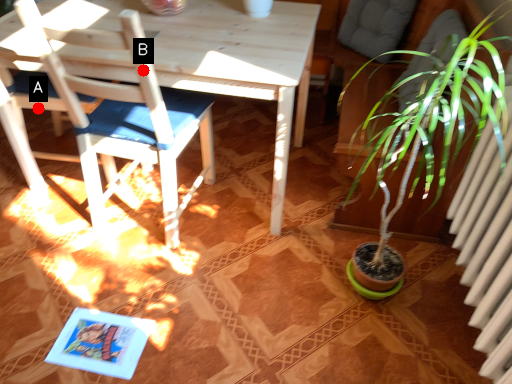
Question: Two points are circled on the image, labeled by A and B beside each circle. Among these points, which one is farthest from the camera?

Choices:
 (A) A is further
 (B) B is further

Answer: (A)